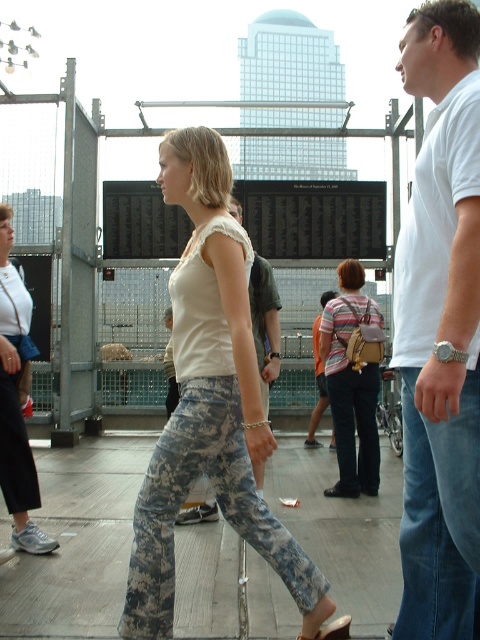
Question: Which object is farther from the camera taking this photo?

Choices:
 (A) camouflage fabric sandal at lower center
 (B) white matte tank top at center
 (C) striped fabric backpack at center
 (D) white cotton t-shirt at center

Answer: (C)

Question: Does striped cotton shirt at center appear on the left side of camouflage fabric sandal at lower center?

Choices:
 (A) yes
 (B) no

Answer: (B)

Question: Considering the real-world distances, which object is farthest from the camouflage pants at center?

Choices:
 (A) white cotton t-shirt at center
 (B) blue denim jeans at right
 (C) striped fabric backpack at center

Answer: (A)

Question: Can you confirm if camouflage fabric pants at center is smaller than blue denim jeans at right?

Choices:
 (A) no
 (B) yes

Answer: (A)

Question: Which of the following is the closest to the observer?

Choices:
 (A) (343, 352)
 (B) (165, 433)

Answer: (B)

Question: Observing the image, what is the correct spatial positioning of blue denim jeans at right in reference to striped cotton shirt at center?

Choices:
 (A) below
 (B) above

Answer: (A)